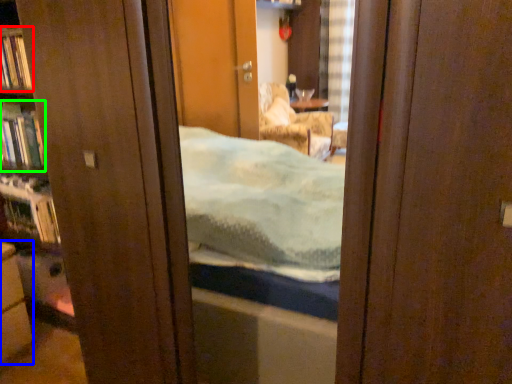
Question: Based on their relative distances, which object is farther from book (highlighted by a red box)? Choose from cabinetry (highlighted by a blue box) and book (highlighted by a green box).

Choices:
 (A) cabinetry
 (B) book

Answer: (A)